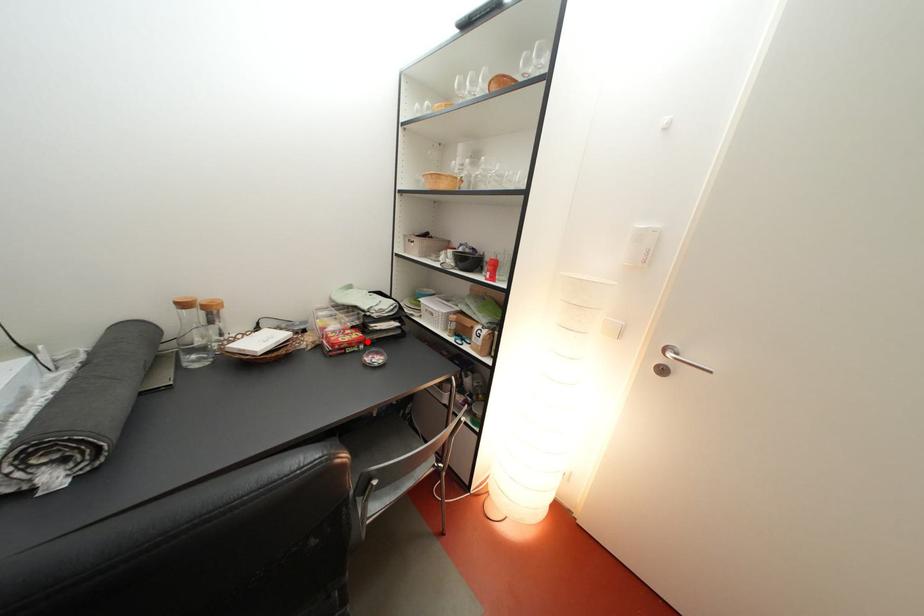
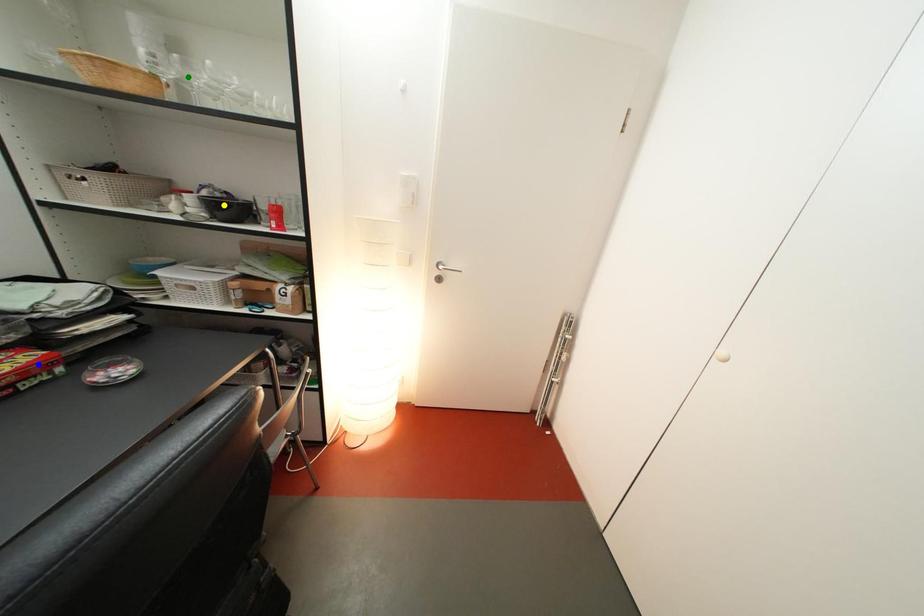
Question: I am providing you with two images of the same scene from different viewpoints. A red point is marked on the first image. You are given multiple points on the second image. Which spot in image 2 lines up with the point in image 1?

Choices:
 (A) green point
 (B) yellow point
 (C) blue point

Answer: (C)